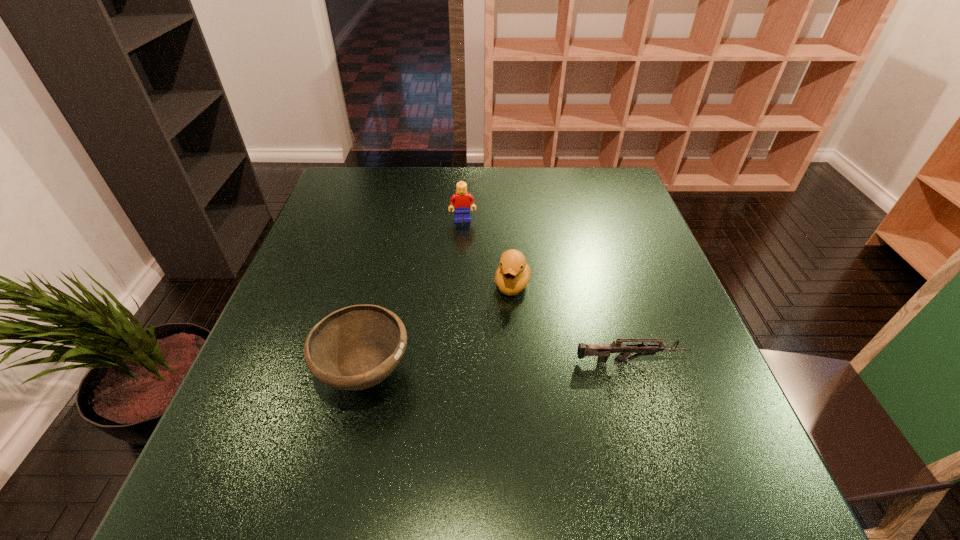
What are the coordinates of `bowl` in the screenshot? It's located at (354, 348).

Find the location of a particular element. gun is located at coordinates (603, 351).

You are a GUI agent. You are given a task and a screenshot of the screen. Output one action in this format:
    pyautogui.click(x=<x>, y=<y>)
    Task: Click on the rightmost object
    This screenshot has height=540, width=960.
    Given the screenshot: What is the action you would take?
    pyautogui.click(x=603, y=351)

Image resolution: width=960 pixels, height=540 pixels. In order to click on the second object from left to right in this screenshot , I will do `click(460, 199)`.

Locate an element on the screen. The height and width of the screenshot is (540, 960). Lego is located at coordinates (460, 199).

The width and height of the screenshot is (960, 540). What are the coordinates of `the second object from right to left` in the screenshot? It's located at (513, 273).

This screenshot has width=960, height=540. In order to click on duckling in this screenshot , I will do [513, 273].

At what (x,y) coordinates should I click in order to perform the action: click on free region located on the back of the leftmost object. Please return your answer as a coordinate pair (x, y). Looking at the image, I should click on (396, 236).

Locate an element on the screen. This screenshot has height=540, width=960. vacant area situated 0.070m on the face of the farthest object is located at coordinates (x=465, y=238).

This screenshot has height=540, width=960. I want to click on vacant space situated 0.180m on the face of the farthest object, so click(x=468, y=266).